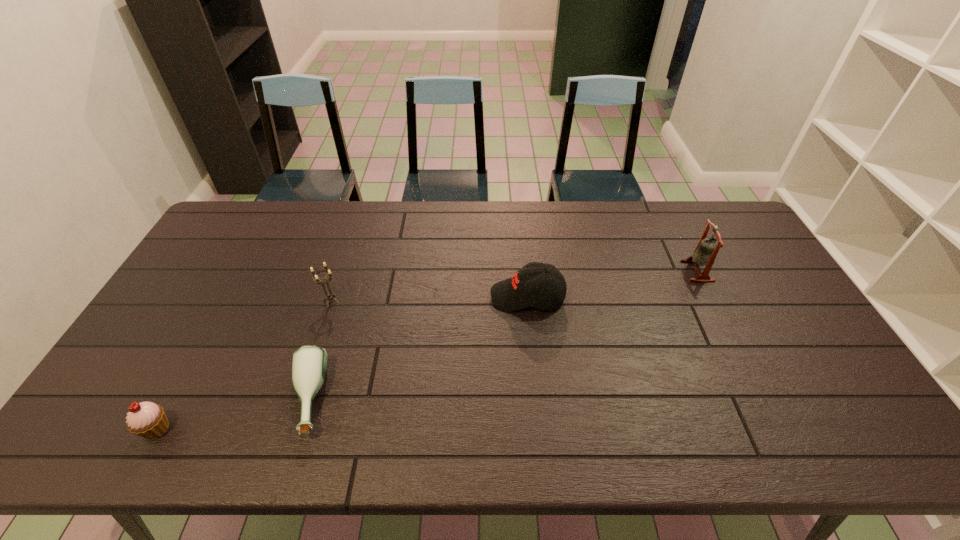
The image size is (960, 540). In order to click on free space located 0.050m on the front-facing side of the baseball cap in this screenshot , I will do `click(474, 296)`.

At what (x,y) coordinates should I click in order to perform the action: click on vacant space located on the right of the leftmost object. Please return your answer as a coordinate pair (x, y). This screenshot has width=960, height=540. Looking at the image, I should click on (270, 429).

You are a GUI agent. You are given a task and a screenshot of the screen. Output one action in this format:
    pyautogui.click(x=<x>, y=<y>)
    Task: Click on the vacant position located on the left of the shortest object
    The width and height of the screenshot is (960, 540).
    Given the screenshot: What is the action you would take?
    pyautogui.click(x=125, y=400)

This screenshot has height=540, width=960. Identify the location of cupcake that is at the near edge. (146, 419).

Image resolution: width=960 pixels, height=540 pixels. What are the coordinates of `bottle that is at the near edge` in the screenshot? It's located at (309, 364).

What are the coordinates of `object that is at the left edge` in the screenshot? It's located at (146, 419).

Find the location of a particular element. Image resolution: width=960 pixels, height=540 pixels. object at the near left corner is located at coordinates (146, 419).

Locate an element on the screen. This screenshot has width=960, height=540. vacant space at the far edge of the desktop is located at coordinates (636, 240).

You are a GUI agent. You are given a task and a screenshot of the screen. Output one action in this format:
    pyautogui.click(x=<x>, y=<y>)
    Task: Click on the vacant region at the near edge of the desktop
    
    Given the screenshot: What is the action you would take?
    pyautogui.click(x=551, y=453)

Where is `free space at the right edge of the desktop`? The height and width of the screenshot is (540, 960). free space at the right edge of the desktop is located at coordinates (824, 415).